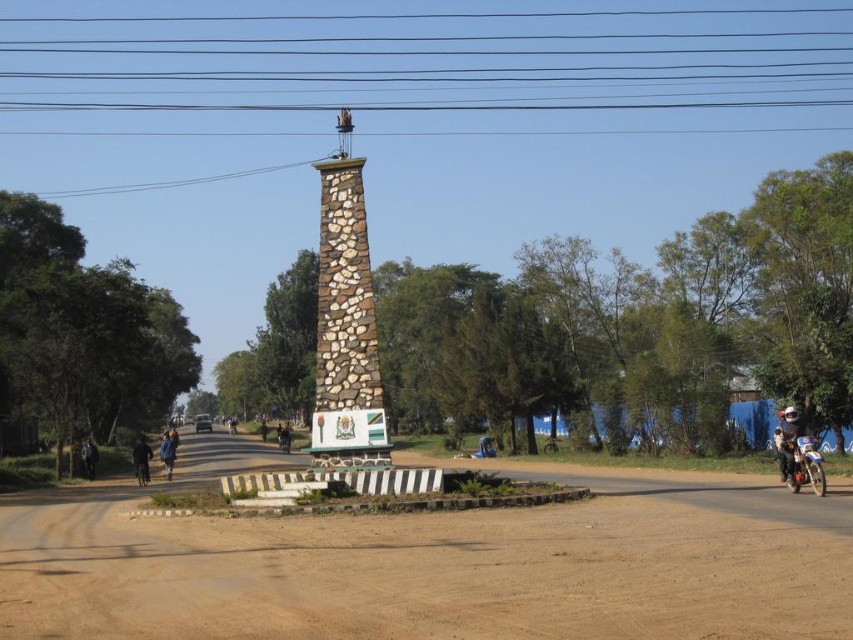
You are a delivery person who needs to decide whether to wear the white glossy helmet at upper right and the blue fabric jacket at center. Considering their sizes, which one might be more suitable to wear comfortably?

The blue fabric jacket at center is larger than the white glossy helmet at upper right, so it is more suitable to wear comfortably.

You are a photographer planning to take a wide shot of the brown stone tower at center and the white glossy helmet at upper right. Which object will appear bigger in the photo?

The brown stone tower at center will appear bigger in the photo because it has a larger size compared to the white glossy helmet at upper right.